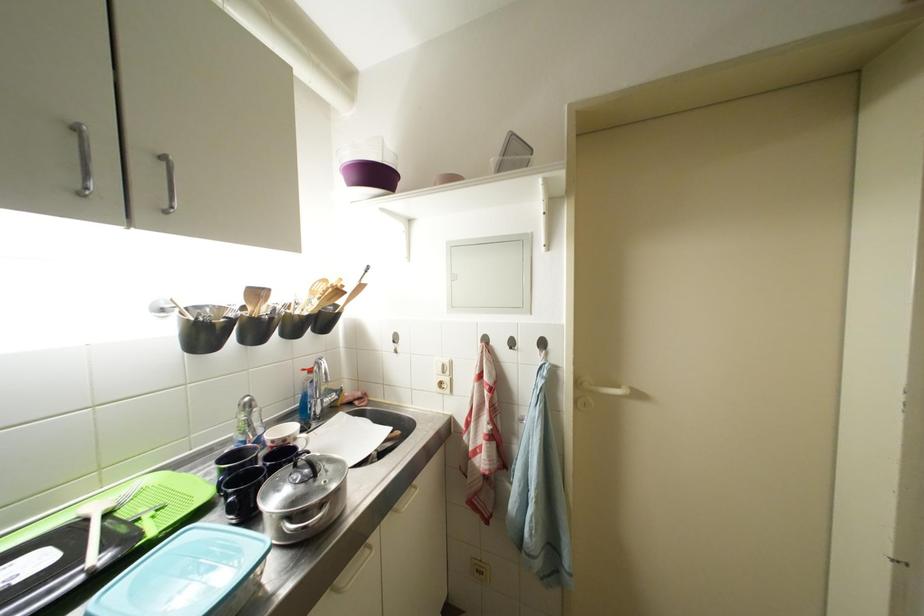
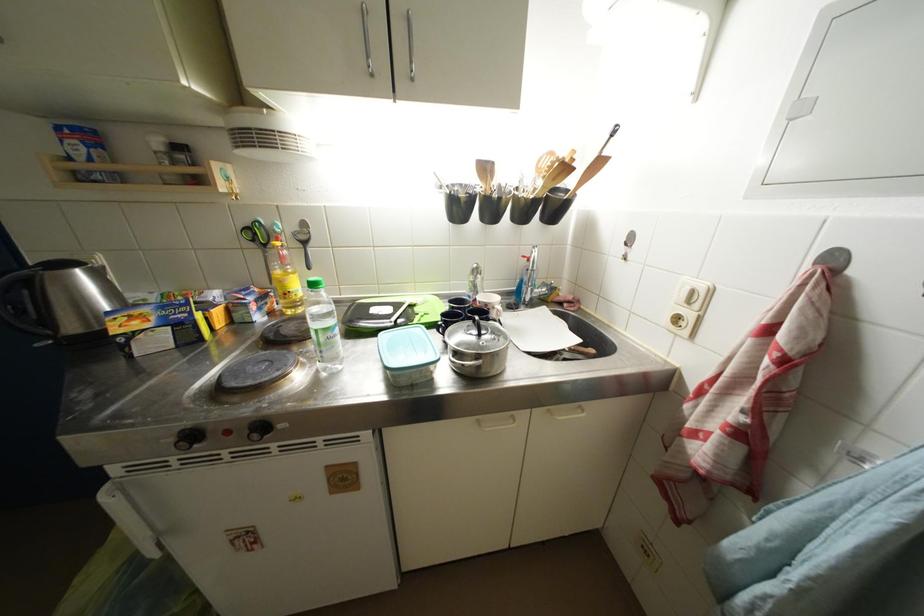
In the second image, find the point that corresponds to [257,429] in the first image.

(481, 291)